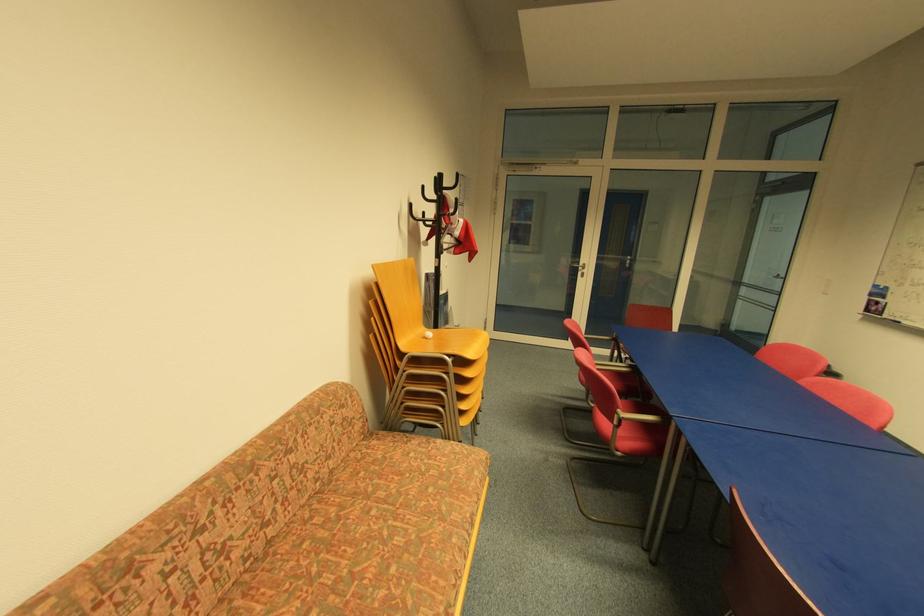
Find the location of a particular element. black coat rack hook is located at coordinates (438, 204).